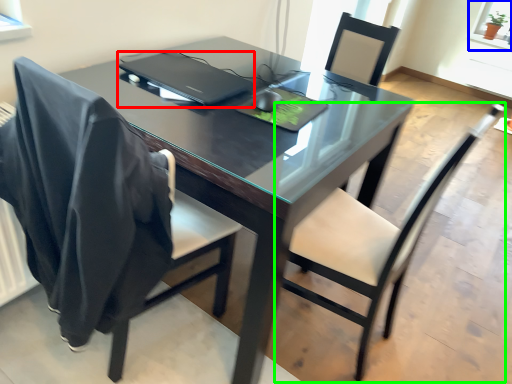
Question: Estimate the real-world distances between objects in this image. Which object is farther from laptop (highlighted by a red box), window screen (highlighted by a blue box) or chair (highlighted by a green box)?

Choices:
 (A) window screen
 (B) chair

Answer: (A)